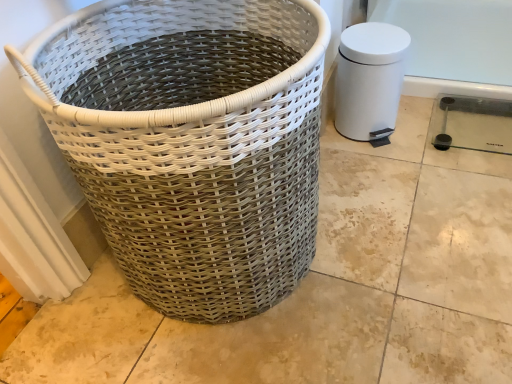
Question: Considering the positions of white matte water heater at right and white woven basket at left in the image, is white matte water heater at right taller or shorter than white woven basket at left?

Choices:
 (A) tall
 (B) short

Answer: (B)

Question: From a real-world perspective, relative to white woven basket at left, is white matte water heater at right vertically above or below?

Choices:
 (A) below
 (B) above

Answer: (A)

Question: Based on their sizes in the image, would you say white matte water heater at right is bigger or smaller than white woven basket at left?

Choices:
 (A) small
 (B) big

Answer: (A)

Question: Is point (309, 150) closer or farther from the camera than point (381, 59)?

Choices:
 (A) closer
 (B) farther

Answer: (A)

Question: In terms of width, does white woven basket at left look wider or thinner when compared to white matte water heater at right?

Choices:
 (A) thin
 (B) wide

Answer: (B)

Question: From the image's perspective, relative to white matte water heater at right, is white woven basket at left above or below?

Choices:
 (A) above
 (B) below

Answer: (B)

Question: In the image, is white woven basket at left positioned in front of or behind white matte water heater at right?

Choices:
 (A) front
 (B) behind

Answer: (A)